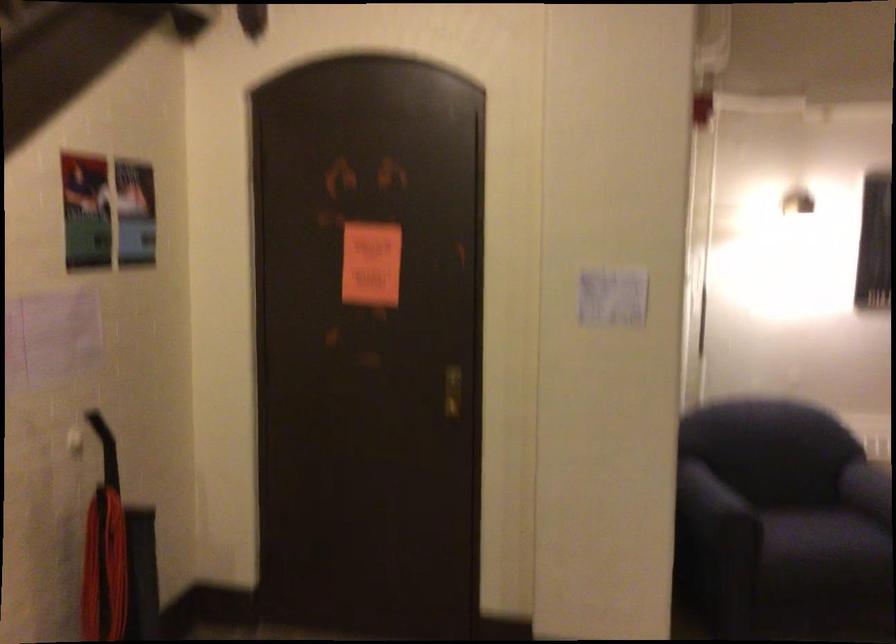
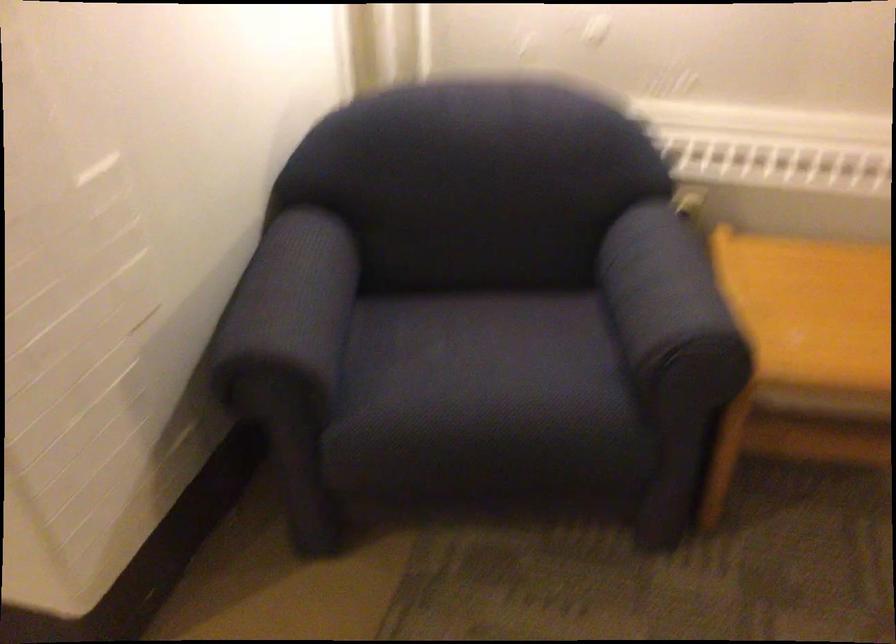
The images are taken continuously from a first-person perspective. In which direction are you moving?

The cameraman moved toward right, forward.